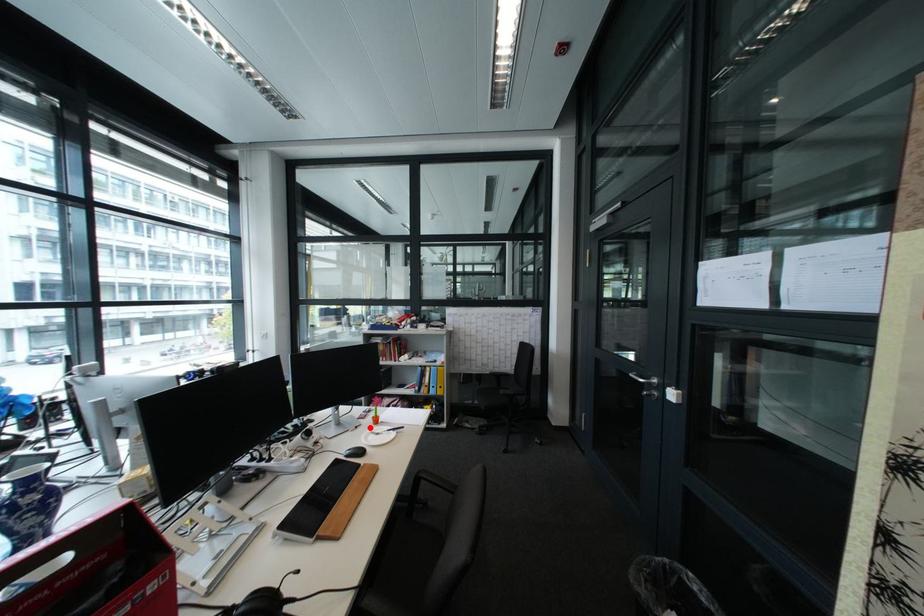
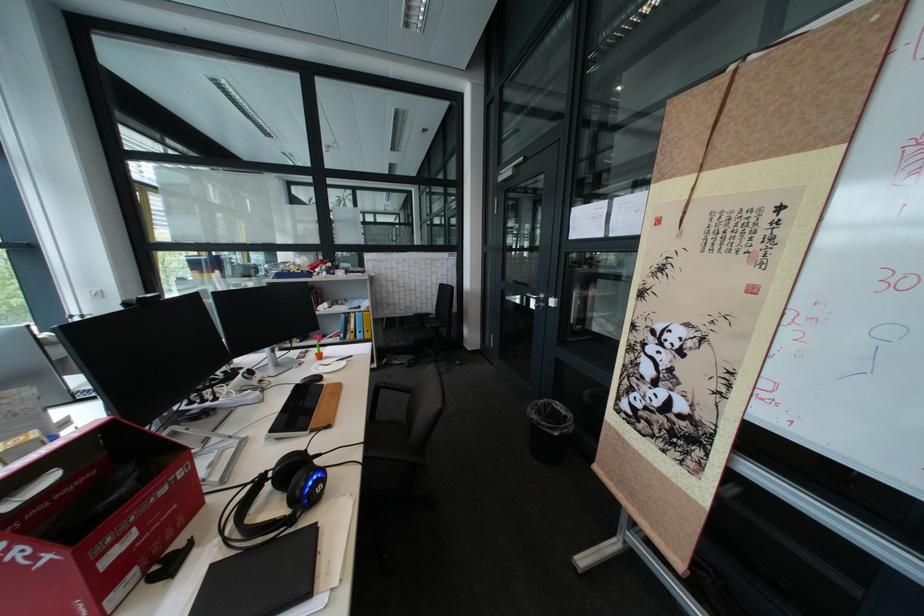
Question: I am providing you with two images of the same scene from different viewpoints. Given a red point in image1, look at the same physical point in image2. Is it:

Choices:
 (A) Closer to the viewpoint
 (B) Farther from the viewpoint

Answer: (B)